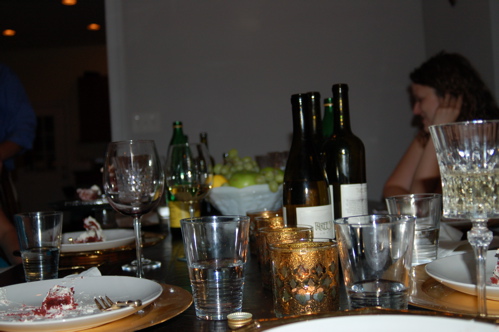
This screenshot has height=332, width=499. I want to click on fork, so click(x=106, y=301).